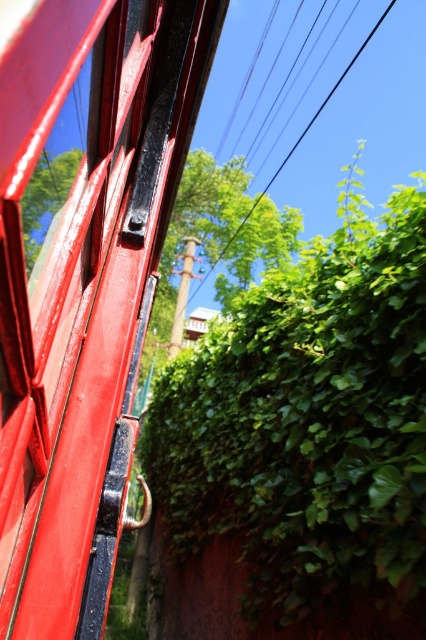
Between point (97, 252) and point (78, 150), which one is positioned behind?

Positioned behind is point (97, 252).

Is point (77, 177) positioned after point (65, 196)?

Yes, it is behind point (65, 196).

Where is `shiny red metal train window at left`? This screenshot has height=640, width=426. shiny red metal train window at left is located at coordinates (81, 276).

Is green leafy hedge at center closer to camera compared to green leafy tree at upper center?

No, green leafy hedge at center is behind green leafy tree at upper center.

Can you confirm if green leafy hedge at center is bigger than green leafy tree at upper center?

Indeed, green leafy hedge at center has a larger size compared to green leafy tree at upper center.

Does point (183, 573) come in front of point (28, 193)?

That is False.

Locate an element on the screen. The image size is (426, 640). green leafy hedge at center is located at coordinates (305, 440).

Can you confirm if green leafy tree at center is smaller than green leafy tree at upper center?

Incorrect, green leafy tree at center is not smaller in size than green leafy tree at upper center.

In the scene shown: Does green leafy tree at center lie in front of green leafy tree at upper center?

No, it is behind green leafy tree at upper center.

This screenshot has width=426, height=640. In order to click on green leafy tree at center in this screenshot , I will do `click(218, 240)`.